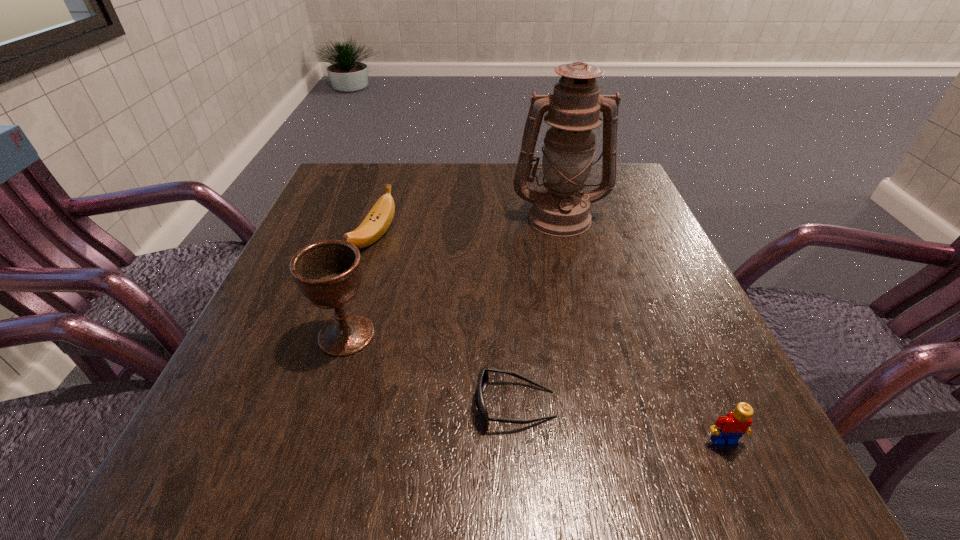
Identify the location of the tallest object. This screenshot has width=960, height=540. (560, 209).

Image resolution: width=960 pixels, height=540 pixels. I want to click on chalice, so click(x=328, y=273).

Locate an element on the screen. the second tallest object is located at coordinates (328, 273).

At what (x,y) coordinates should I click in order to perform the action: click on banana. Please return your answer as a coordinate pair (x, y). This screenshot has width=960, height=540. Looking at the image, I should click on (378, 220).

Locate an element on the screen. The image size is (960, 540). the rightmost object is located at coordinates (728, 429).

This screenshot has width=960, height=540. What are the coordinates of `the nearest object` in the screenshot? It's located at (728, 429).

This screenshot has width=960, height=540. What are the coordinates of `the fourth farthest object` in the screenshot? It's located at (483, 378).

You are a GUI agent. You are given a task and a screenshot of the screen. Output one action in this format:
    pyautogui.click(x=<x>, y=<y>)
    Task: Click on the sunglasses
    This screenshot has height=540, width=960.
    Given the screenshot: What is the action you would take?
    pyautogui.click(x=483, y=378)

What are the coordinates of `vacant area situated 0.150m on the front of the oil lamp` in the screenshot? It's located at (575, 284).

Where is `free region located on the back of the chalice`? free region located on the back of the chalice is located at coordinates (361, 287).